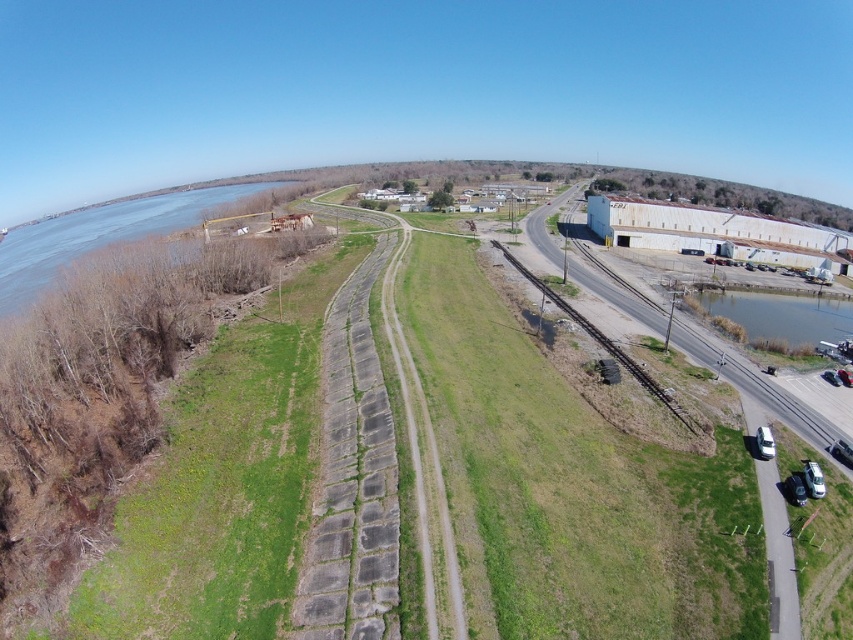
Consider the image. You are a drone operator trying to capture a photo of both the blue water at left and the clear water at lower right. Which body of water appears wider in the image?

The blue water at left appears wider than the clear water at lower right because its width surpasses the latter according to the description.

You are a surveyor assessing the terrain for a new drainage project. You observe the blue water at left and the clear water at lower right in the scene. Which body of water is higher in elevation based on their positions?

The blue water at left is higher in elevation because it has a greater height compared to the clear water at lower right.

You are standing at the center of the grassy field with the concrete pathway in front of you. You want to walk to the clear water at lower right. Which direction should you head towards? The point given is at coordinate (x=781, y=314). Please provide your answer in terms of cardinal directions like north, south, etc., or relative directions like left, right, forward, backward. Also, mention the coordinate point in your answer.

To reach the clear water at lower right corresponding to the point at coordinate (x=781, y=314), you should head towards the lower right direction from your current position at the center of the grassy field. This direction aligns with the coordinate provided.